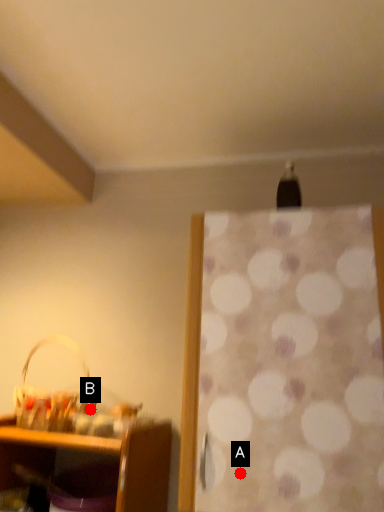
Question: Two points are circled on the image, labeled by A and B beside each circle. Among these points, which one is farthest from the camera?

Choices:
 (A) A is further
 (B) B is further

Answer: (B)